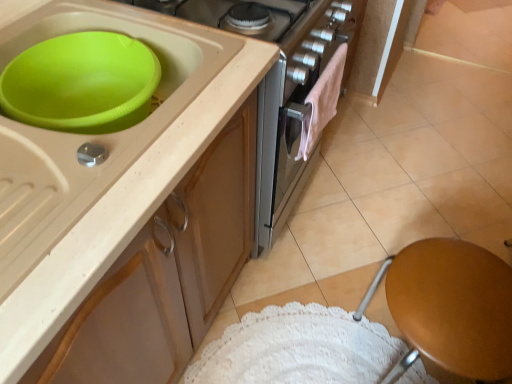
The image size is (512, 384). Identify the location of vacant region to the left of brown wooden stool at lower right. (292, 332).